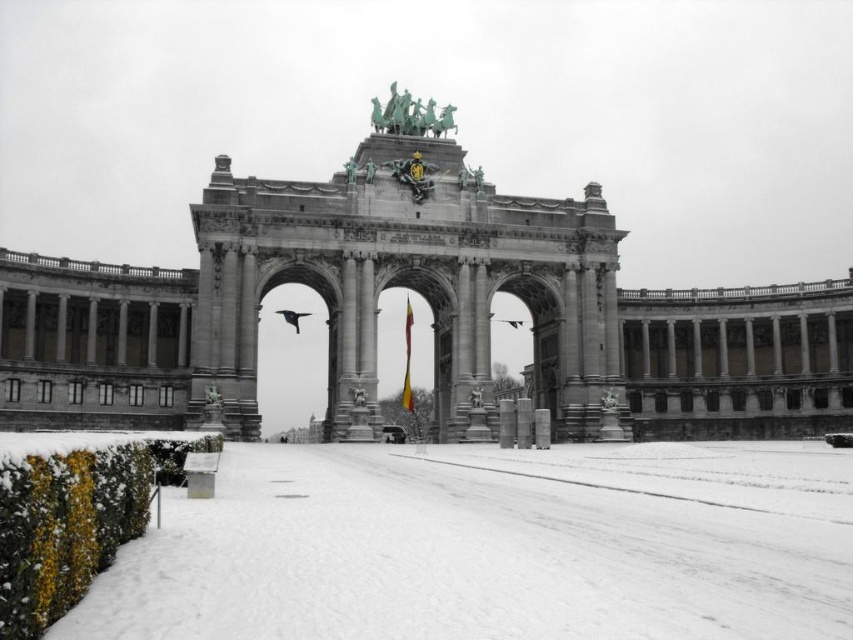
You are a visitor standing in front of the stone archway at center and the yellow fabric flag at center. Which object is closer to you?

The stone archway at center is closer to you because it is in front of the yellow fabric flag at center.

You are planning to drive a delivery truck that is 10 meters wide through the image. The truck needs to pass through either the stone archway at center or the white powdery snow at lower left. Based on their widths, which location would allow the truck to pass without getting stuck?

The stone archway at center has a larger width than the white powdery snow at lower left. Therefore, the delivery truck that is 10 meters wide should pass through the stone archway at center since it is wider.